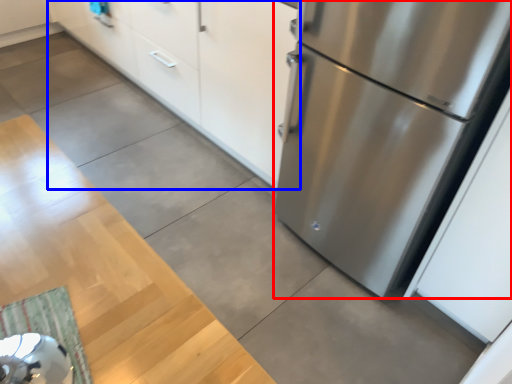
Question: Among these objects, which one is nearest to the camera, refrigerator (highlighted by a red box) or cabinetry (highlighted by a blue box)?

Choices:
 (A) refrigerator
 (B) cabinetry

Answer: (A)